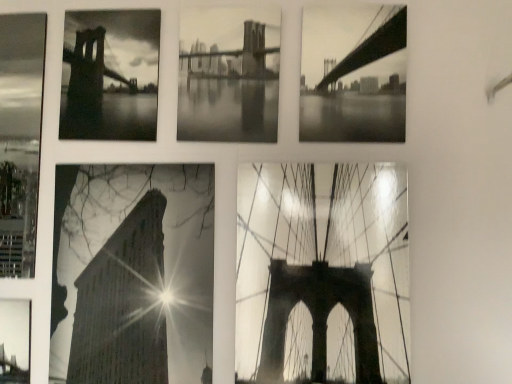
Question: Are monochrome paper brooklyn bridge at center, the fourth picture frame in the left-to-right sequence, and high contrast paper building at bottom left, the 3th picture frame in the left-to-right sequence, far apart?

Choices:
 (A) no
 (B) yes

Answer: (A)

Question: Is monochrome paper brooklyn bridge at center, the fourth picture frame in the left-to-right sequence, looking in the opposite direction of high contrast paper building at bottom left, the 3th picture frame in the left-to-right sequence?

Choices:
 (A) no
 (B) yes

Answer: (A)

Question: From a real-world perspective, is monochrome paper brooklyn bridge at center, marked as the 3th picture frame in a right-to-left arrangement, on high contrast paper building at bottom left, the 4th picture frame in the right-to-left sequence?

Choices:
 (A) yes
 (B) no

Answer: (A)

Question: Does monochrome paper brooklyn bridge at center, marked as the 3th picture frame in a right-to-left arrangement, come in front of high contrast paper building at bottom left, the 4th picture frame in the right-to-left sequence?

Choices:
 (A) yes
 (B) no

Answer: (B)

Question: Is high contrast paper building at bottom left, the 4th picture frame in the right-to-left sequence, a part of monochrome paper brooklyn bridge at center, marked as the 3th picture frame in a right-to-left arrangement?

Choices:
 (A) no
 (B) yes

Answer: (A)

Question: From the image's perspective, is matte glass bridge at center, acting as the 2th picture frame starting from the right, above or below metallic bridge at bottom left, which ranks as the first picture frame in left-to-right order?

Choices:
 (A) above
 (B) below

Answer: (A)

Question: In the image, is matte glass bridge at center, which is the 5th picture frame in left-to-right order, positioned in front of or behind metallic bridge at bottom left, which is the 6th picture frame in right-to-left order?

Choices:
 (A) front
 (B) behind

Answer: (A)

Question: In terms of height, does matte glass bridge at center, which is the 5th picture frame in left-to-right order, look taller or shorter compared to metallic bridge at bottom left, which is the 6th picture frame in right-to-left order?

Choices:
 (A) tall
 (B) short

Answer: (A)

Question: In terms of width, does matte glass bridge at center, acting as the 2th picture frame starting from the right, look wider or thinner when compared to metallic bridge at bottom left, which is the 6th picture frame in right-to-left order?

Choices:
 (A) thin
 (B) wide

Answer: (B)

Question: From the image's perspective, relative to monochrome bridge at upper left, which is the 2th picture frame in left-to-right order, is monochrome bridge at upper right, arranged as the 1th picture frame when viewed from the right, above or below?

Choices:
 (A) above
 (B) below

Answer: (B)

Question: Relative to monochrome bridge at upper left, positioned as the 5th picture frame in right-to-left order, is monochrome bridge at upper right, the sixth picture frame in the left-to-right sequence, in front or behind?

Choices:
 (A) behind
 (B) front

Answer: (B)

Question: From a real-world perspective, is monochrome bridge at upper right, the sixth picture frame in the left-to-right sequence, positioned above or below monochrome bridge at upper left, which is the 2th picture frame in left-to-right order?

Choices:
 (A) above
 (B) below

Answer: (A)

Question: In terms of size, does monochrome bridge at upper right, arranged as the 1th picture frame when viewed from the right, appear bigger or smaller than monochrome bridge at upper left, positioned as the 5th picture frame in right-to-left order?

Choices:
 (A) small
 (B) big

Answer: (A)

Question: Considering the relative positions of monochrome bridge at upper right, the sixth picture frame in the left-to-right sequence, and high contrast paper building at bottom left, the 3th picture frame in the left-to-right sequence, in the image provided, is monochrome bridge at upper right, the sixth picture frame in the left-to-right sequence, to the left or to the right of high contrast paper building at bottom left, the 3th picture frame in the left-to-right sequence,?

Choices:
 (A) right
 (B) left

Answer: (A)

Question: From the image's perspective, relative to high contrast paper building at bottom left, the 3th picture frame in the left-to-right sequence, is monochrome bridge at upper right, the sixth picture frame in the left-to-right sequence, above or below?

Choices:
 (A) above
 (B) below

Answer: (A)